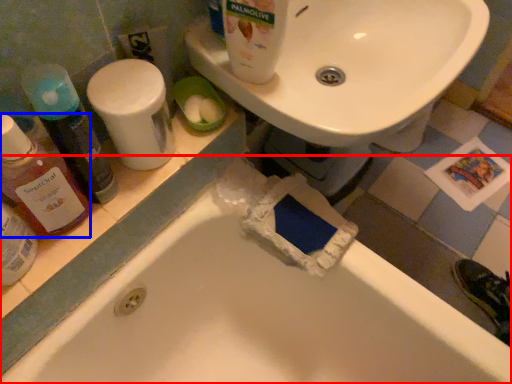
Question: Which object is closer to the camera taking this photo, bathtub (highlighted by a red box) or cleaning product (highlighted by a blue box)?

Choices:
 (A) bathtub
 (B) cleaning product

Answer: (A)